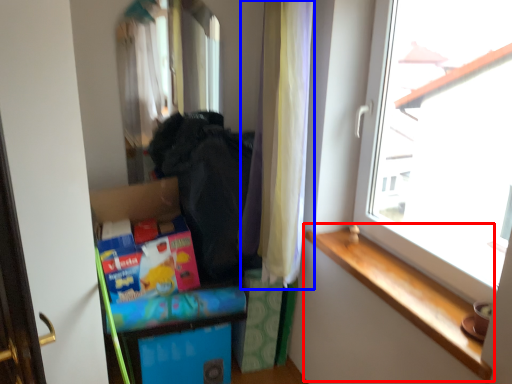
Question: Which of the following is the closest to the observer, window sill (highlighted by a red box) or curtain (highlighted by a blue box)?

Choices:
 (A) window sill
 (B) curtain

Answer: (A)